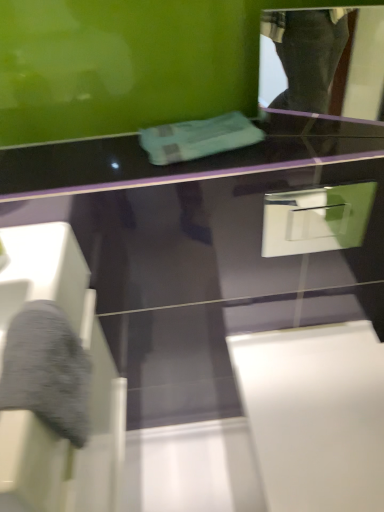
This screenshot has width=384, height=512. What do you see at coordinates (316, 219) in the screenshot? I see `white glossy drawer at upper right` at bounding box center [316, 219].

You are a GUI agent. You are given a task and a screenshot of the screen. Output one action in this format:
    pyautogui.click(x=<x>, y=<y>)
    Task: Click on the teal fabric towel at center
    The width and height of the screenshot is (384, 512).
    Given the screenshot: What is the action you would take?
    (x=198, y=138)

Locate an element on the screen. white glossy drawer at upper right is located at coordinates (316, 219).

Can you confirm if teal fabric towel at center is positioned to the left of glossy plastic mirror at upper right?

Yes.

From the picture: Who is smaller, teal fabric towel at center or glossy plastic mirror at upper right?

teal fabric towel at center is smaller.

From a real-world perspective, who is located lower, teal fabric towel at center or glossy plastic mirror at upper right?

teal fabric towel at center is physically lower.

Considering the positions of points (265, 254) and (214, 145), is point (265, 254) closer to camera compared to point (214, 145)?

No, it is not.

Visually, is white glossy drawer at upper right positioned to the left or to the right of teal fabric towel at center?

white glossy drawer at upper right is positioned on teal fabric towel at center's right side.

Which object is closer to the camera, white glossy drawer at upper right or teal fabric towel at center?

white glossy drawer at upper right is in front.

Looking at this image, considering the sizes of objects white glossy drawer at upper right and teal fabric towel at center in the image provided, who is wider, white glossy drawer at upper right or teal fabric towel at center?

With larger width is teal fabric towel at center.

From a real-world perspective, is glossy plastic mirror at upper right physically above teal fabric towel at center?

Yes, from a real-world perspective, glossy plastic mirror at upper right is on top of teal fabric towel at center.

Identify the location of mirror lying above the teal fabric towel at center (from the image's perspective). Image resolution: width=384 pixels, height=512 pixels. pos(325,63).

Which point is more distant from viewer, (x=304, y=109) or (x=244, y=139)?

The point (x=304, y=109) is farther.

How distant is teal fabric towel at center from white glossy drawer at upper right?

The distance of teal fabric towel at center from white glossy drawer at upper right is 16.30 inches.

Is teal fabric towel at center not close to white glossy drawer at upper right?

That's not correct — teal fabric towel at center is a little close to white glossy drawer at upper right.

Is teal fabric towel at center smaller than white glossy drawer at upper right?

Yes, teal fabric towel at center is smaller than white glossy drawer at upper right.

From a real-world perspective, which is physically below, teal fabric towel at center or white glossy drawer at upper right?

From a 3D spatial view, white glossy drawer at upper right is below.

In the scene shown: From the image's perspective, relative to glossy plastic mirror at upper right, is white glossy drawer at upper right above or below?

From the image's perspective, white glossy drawer at upper right appears below glossy plastic mirror at upper right.

Considering the points (318, 234) and (326, 88), which point is behind, point (318, 234) or point (326, 88)?

The point (326, 88) is more distant.

Does white glossy drawer at upper right touch glossy plastic mirror at upper right?

No, white glossy drawer at upper right is not in contact with glossy plastic mirror at upper right.

Consider the image. Considering the relative sizes of white glossy drawer at upper right and glossy plastic mirror at upper right in the image provided, is white glossy drawer at upper right taller than glossy plastic mirror at upper right?

Incorrect, the height of white glossy drawer at upper right is not larger of that of glossy plastic mirror at upper right.

This screenshot has height=512, width=384. Find the location of `drawer on the left of glossy plastic mirror at upper right`. drawer on the left of glossy plastic mirror at upper right is located at coordinates (316, 219).

Can you confirm if glossy plastic mirror at upper right is wider than white glossy drawer at upper right?

Yes, glossy plastic mirror at upper right is wider than white glossy drawer at upper right.

Based on the photo, measure the distance between glossy plastic mirror at upper right and white glossy drawer at upper right.

A distance of 72.80 centimeters exists between glossy plastic mirror at upper right and white glossy drawer at upper right.

Based on the photo, is glossy plastic mirror at upper right facing towards white glossy drawer at upper right?

No, glossy plastic mirror at upper right does not turn towards white glossy drawer at upper right.

The height and width of the screenshot is (512, 384). I want to click on towel below the glossy plastic mirror at upper right (from the image's perspective), so click(198, 138).

The height and width of the screenshot is (512, 384). What are the coordinates of `drawer directly beneath the teal fabric towel at center (from a real-world perspective)` in the screenshot? It's located at (316, 219).

Based on their spatial positions, is teal fabric towel at center or white glossy drawer at upper right further from glossy plastic mirror at upper right?

teal fabric towel at center is positioned further to the anchor glossy plastic mirror at upper right.

Estimate the real-world distances between objects in this image. Which object is closer to white glossy drawer at upper right, teal fabric towel at center or glossy plastic mirror at upper right?

teal fabric towel at center is positioned closer to the anchor white glossy drawer at upper right.

Based on their spatial positions, is glossy plastic mirror at upper right or teal fabric towel at center further from white glossy drawer at upper right?

The object further to white glossy drawer at upper right is glossy plastic mirror at upper right.

Based on their spatial positions, is white glossy drawer at upper right or teal fabric towel at center closer to glossy plastic mirror at upper right?

The object closer to glossy plastic mirror at upper right is white glossy drawer at upper right.

Considering their positions, is white glossy drawer at upper right positioned further to teal fabric towel at center than glossy plastic mirror at upper right?

glossy plastic mirror at upper right is positioned further to the anchor teal fabric towel at center.

Looking at the image, which one is located closer to teal fabric towel at center, glossy plastic mirror at upper right or white glossy drawer at upper right?

The object closer to teal fabric towel at center is white glossy drawer at upper right.

I want to click on drawer between teal fabric towel at center and glossy plastic mirror at upper right from left to right, so (316, 219).